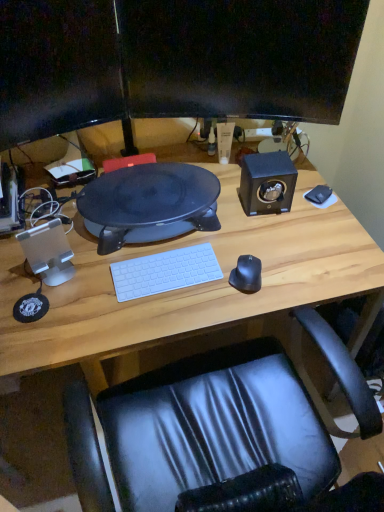
Where is `vacant region above black plastic computer at center (from a real-world perspective)`? This screenshot has width=384, height=512. vacant region above black plastic computer at center (from a real-world perspective) is located at coordinates (x=154, y=190).